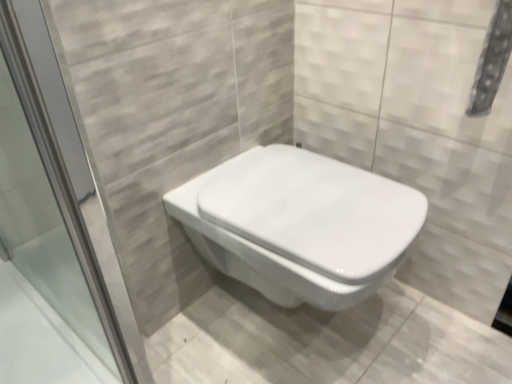
What do you see at coordinates (300, 225) in the screenshot? The image size is (512, 384). I see `white glossy toilet at center` at bounding box center [300, 225].

Where is `white glossy toilet at center`? The height and width of the screenshot is (384, 512). white glossy toilet at center is located at coordinates (300, 225).

Find the location of a particular element. The image size is (512, 384). white glossy toilet at center is located at coordinates (300, 225).